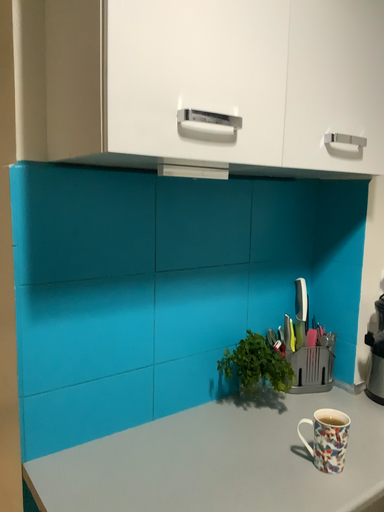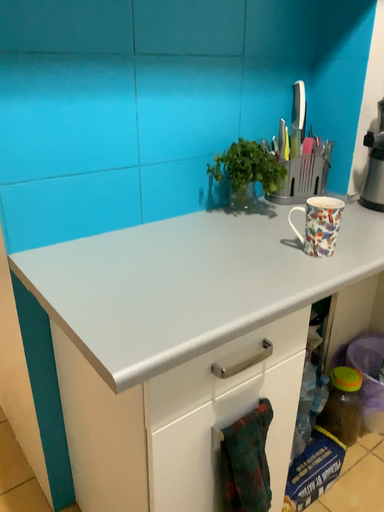
Question: How did the camera likely rotate when shooting the video?

Choices:
 (A) rotated downward
 (B) rotated upward

Answer: (A)